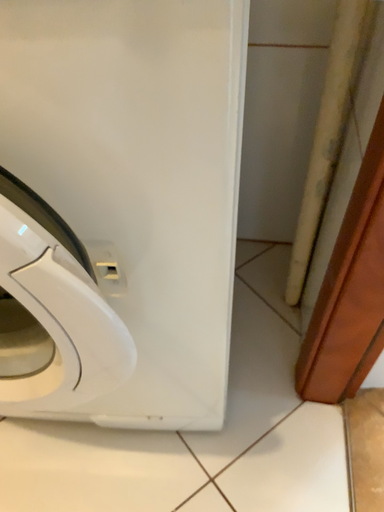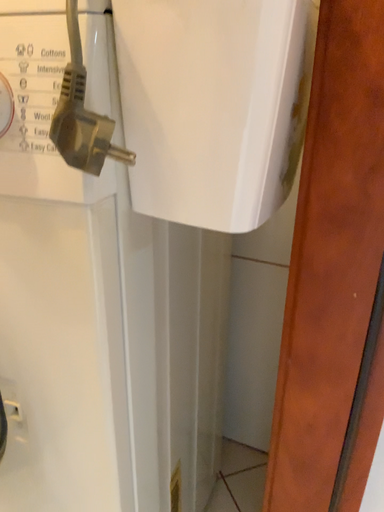
Question: How did the camera likely rotate when shooting the video?

Choices:
 (A) rotated left
 (B) rotated right

Answer: (A)